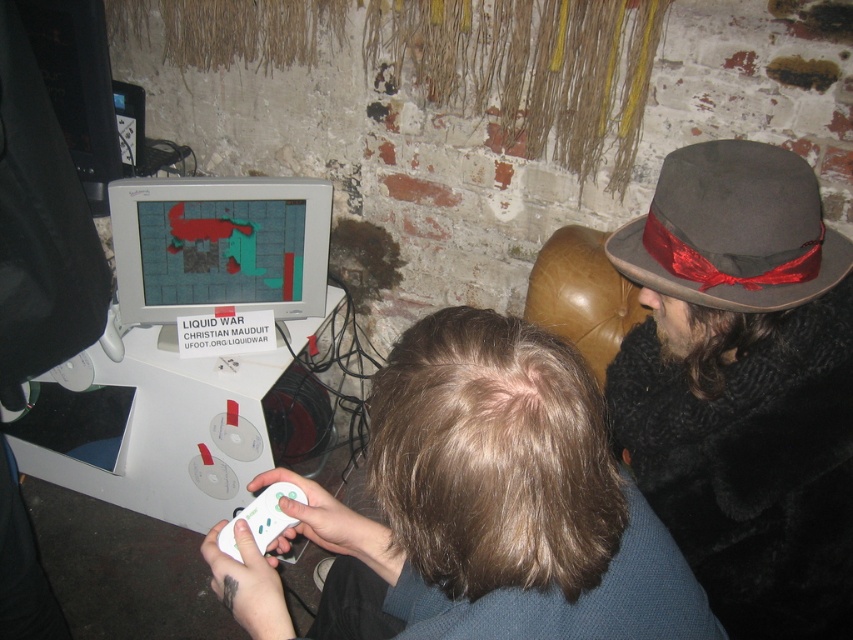
Between matte plastic monitor at center and white plastic game controller at lower center, which one is positioned lower?

white plastic game controller at lower center is below.

Where is `matte plastic monitor at center`? Image resolution: width=853 pixels, height=640 pixels. matte plastic monitor at center is located at coordinates (219, 244).

Which is in front, point (544, 561) or point (721, 566)?

Point (544, 561) is more forward.

Which is behind, point (618, 490) or point (764, 538)?

Positioned behind is point (764, 538).

Where is `dark brown hair at center`? dark brown hair at center is located at coordinates (492, 502).

The width and height of the screenshot is (853, 640). I want to click on dark brown hair at center, so click(492, 502).

Measure the distance between dark brown fur coat at right and matte plastic monitor at center.

They are 34.43 inches apart.

Is dark brown fur coat at right thinner than matte plastic monitor at center?

Yes.

Describe the element at coordinates (743, 385) in the screenshot. I see `dark brown fur coat at right` at that location.

I want to click on dark brown fur coat at right, so click(743, 385).